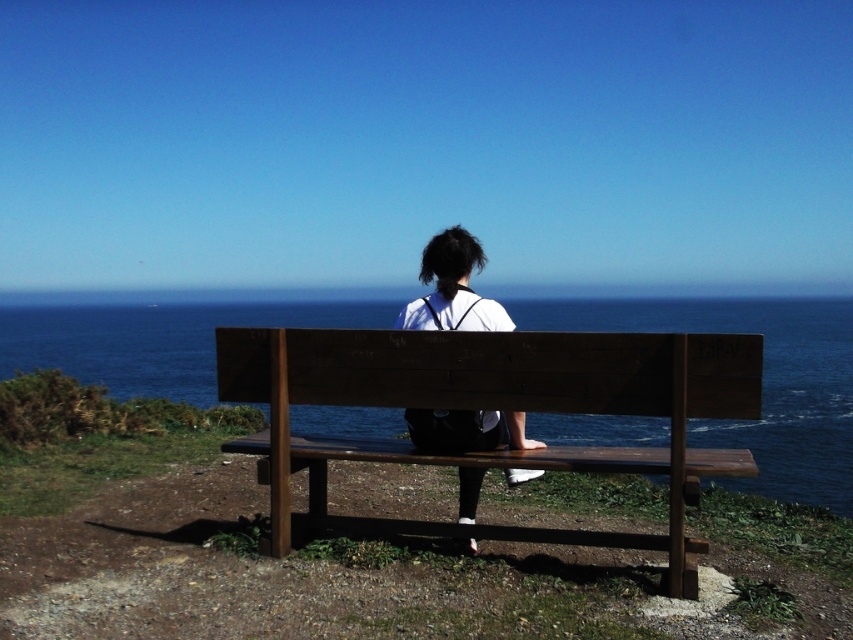
Does blue water at center appear over white matte shirt at center?

Yes, blue water at center is above white matte shirt at center.

Measure the distance between blue water at center and camera.

blue water at center is 3.46 meters away from camera.

You are a GUI agent. You are given a task and a screenshot of the screen. Output one action in this format:
    pyautogui.click(x=<x>, y=<y>)
    Task: Click on the blue water at center
    Image resolution: width=853 pixels, height=640 pixels.
    Given the screenshot: What is the action you would take?
    pyautogui.click(x=762, y=381)

Is brown wooden bench at center positioned at the back of white matte shirt at center?

No, it is not.

Which of these two, brown wooden bench at center or white matte shirt at center, stands taller?

Standing taller between the two is white matte shirt at center.

What are the coordinates of `brown wooden bench at center` in the screenshot? It's located at (494, 406).

Does brown wooden bench at center have a lesser height compared to blue water at center?

Indeed, brown wooden bench at center has a lesser height compared to blue water at center.

Which of these two, brown wooden bench at center or blue water at center, stands taller?

blue water at center

Which is behind, point (672, 378) or point (366, 422)?

Point (366, 422)

Where is `brown wooden bench at center`? This screenshot has width=853, height=640. brown wooden bench at center is located at coordinates (494, 406).